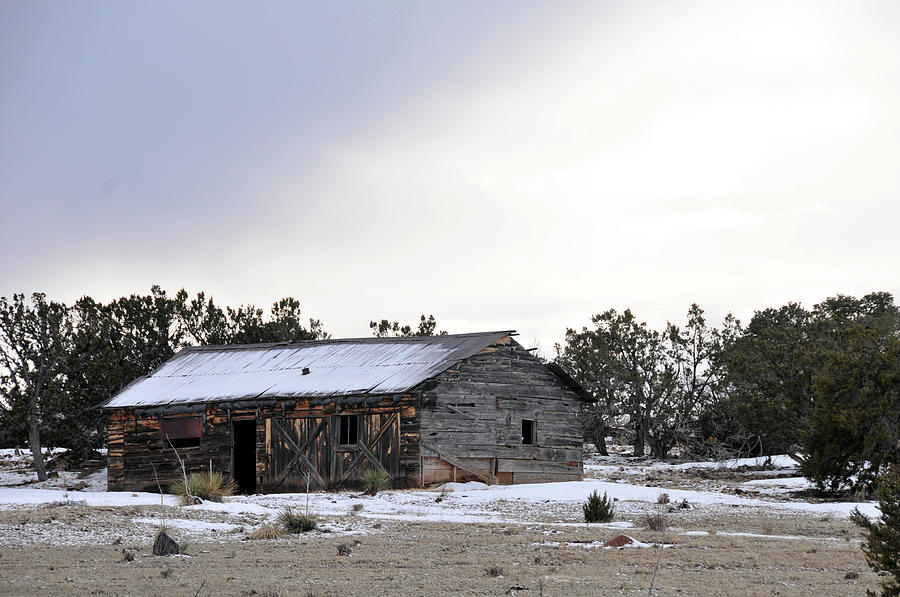
Find the location of a particular element. The height and width of the screenshot is (597, 900). doorway is located at coordinates (249, 427).